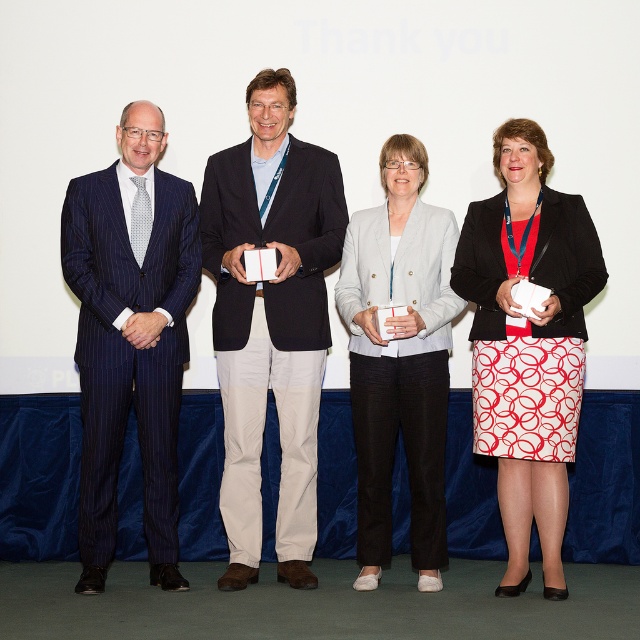
Does matte black suit at center appear under blue pinstripe suit at left?

No.

Where is `matte black suit at center`? The height and width of the screenshot is (640, 640). matte black suit at center is located at coordinates (269, 321).

Where is `matte black suit at center`? Image resolution: width=640 pixels, height=640 pixels. matte black suit at center is located at coordinates (269, 321).

Which is more to the right, blue pinstripe suit at left or light gray blazer at center?

From the viewer's perspective, light gray blazer at center appears more on the right side.

Describe the element at coordinates (131, 337) in the screenshot. I see `blue pinstripe suit at left` at that location.

Between point (172, 365) and point (403, 442), which one is positioned behind?

The point (403, 442) is more distant.

At what (x,y) coordinates should I click in order to perform the action: click on blue pinstripe suit at left. Please return your answer as a coordinate pair (x, y). Looking at the image, I should click on (131, 337).

How far apart are matte black suit at center and light gray blazer at center?

matte black suit at center and light gray blazer at center are 19.32 inches apart.

Who is higher up, matte black suit at center or light gray blazer at center?

matte black suit at center is higher up.

Is point (218, 161) closer to viewer compared to point (424, 264)?

No.

The image size is (640, 640). Identify the location of matte black suit at center. (269, 321).